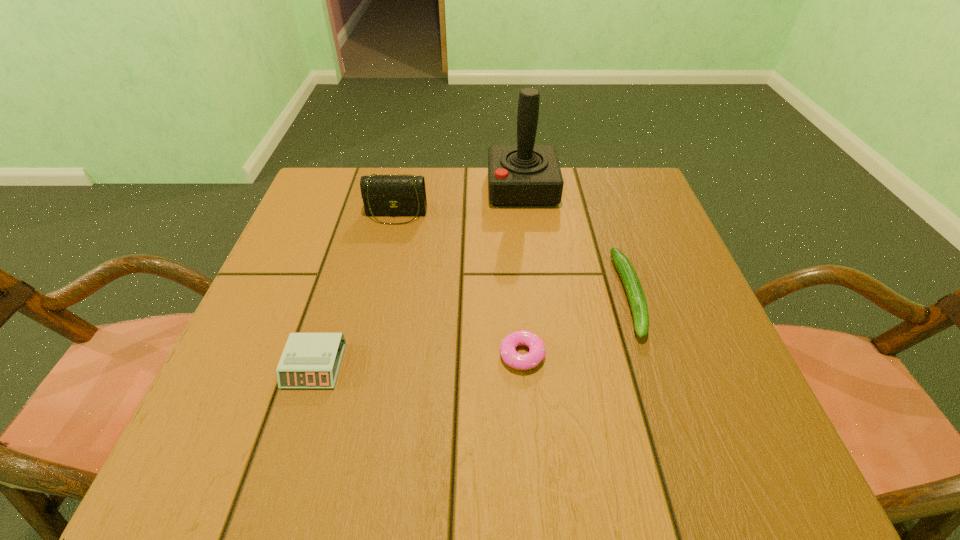
The width and height of the screenshot is (960, 540). I want to click on empty space that is in between the zucchini and the fourth shortest object, so click(x=513, y=254).

Locate an element on the screen. empty space between the rightmost object and the alarm clock is located at coordinates (472, 330).

The image size is (960, 540). Identify the location of free point between the zucchini and the clutch bag. (513, 254).

Locate an element on the screen. This screenshot has height=540, width=960. vacant point located between the doughnut and the tallest object is located at coordinates (522, 272).

Where is `free area in between the alarm clock and the clutch bag`? This screenshot has width=960, height=540. free area in between the alarm clock and the clutch bag is located at coordinates (355, 289).

Identify which object is located as the fourth nearest to the doughnut. Please provide its 2D coordinates. Your answer should be formatted as a tuple, i.e. [(x, y)], where the tuple contains the x and y coordinates of a point satisfying the conditions above.

[(524, 175)]

Identify which object is the second closest to the alarm clock. Please provide its 2D coordinates. Your answer should be formatted as a tuple, i.e. [(x, y)], where the tuple contains the x and y coordinates of a point satisfying the conditions above.

[(384, 195)]

Identify the location of free space that satisfies the following two spatial constraints: 1. on the front flap of the doughnut; 2. on the right side of the clutch bag. (365, 355).

Locate an element on the screen. vacant space that satisfies the following two spatial constraints: 1. on the base of the joystick; 2. on the front side of the alarm clock is located at coordinates (543, 366).